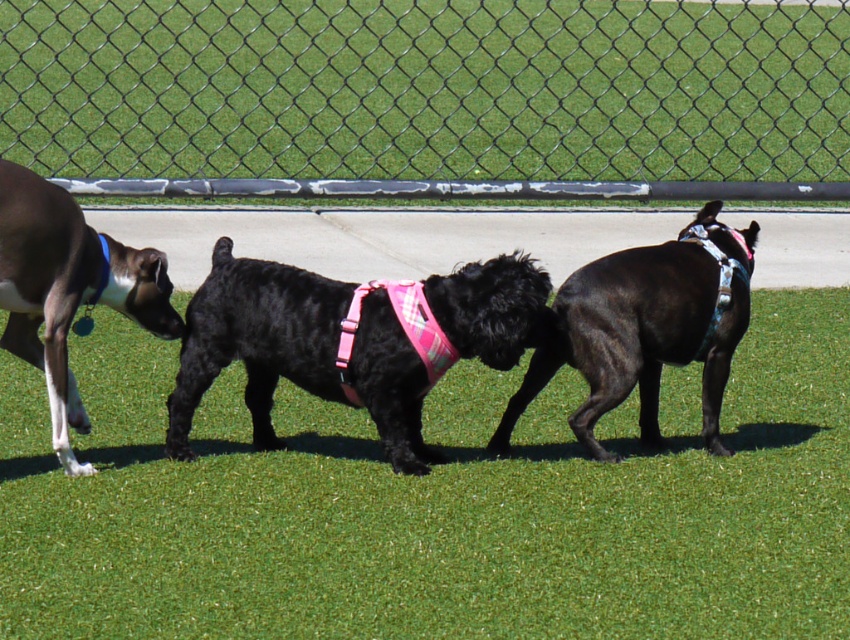
You are a dog owner trying to decide where to let your dog play in the park. You have two options in the image provided. The first option is the green grass at center and the second is the shiny black dog at center. Which area would allow your dog to move more freely without obstruction?

The shiny black dog at center is taller than the green grass at center, so the dog can move more freely in the area with the green grass at center since it is shorter and less obstructive.